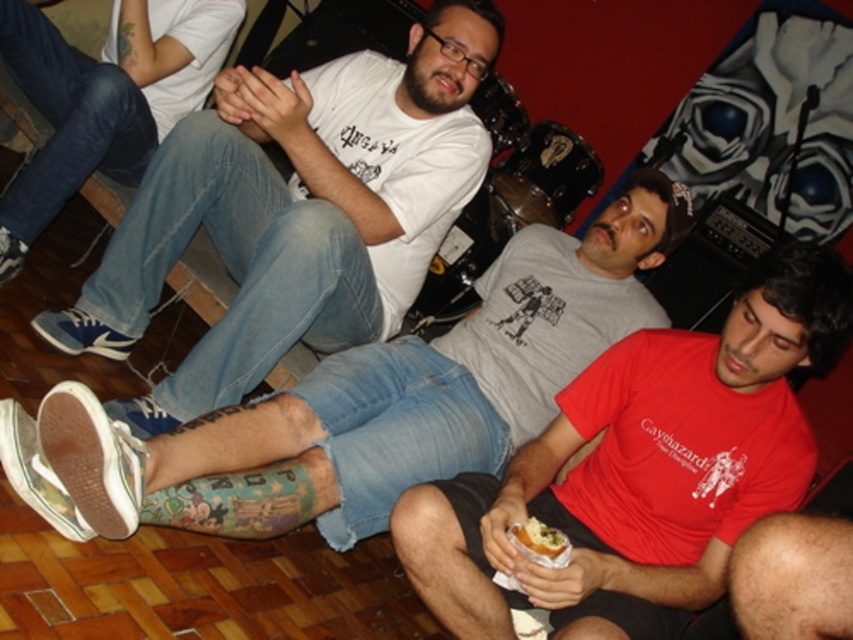
Looking at this image, is white matte t-shirt at center to the left of white bread at lower center from the viewer's perspective?

Correct, you'll find white matte t-shirt at center to the left of white bread at lower center.

In the scene shown: Who is taller, white matte t-shirt at center or white bread at lower center?

With more height is white matte t-shirt at center.

The image size is (853, 640). What do you see at coordinates (296, 211) in the screenshot? I see `white matte t-shirt at center` at bounding box center [296, 211].

Where is `white matte t-shirt at center`? white matte t-shirt at center is located at coordinates (296, 211).

Is red matte shirt at lower right below denim jeans at center?

Yes.

Does point (769, 307) lie in front of point (44, 216)?

Yes, it is in front of point (44, 216).

The image size is (853, 640). I want to click on red matte shirt at lower right, so click(642, 468).

Describe the element at coordinates (296, 211) in the screenshot. The width and height of the screenshot is (853, 640). I see `white matte t-shirt at center` at that location.

Where is `white matte t-shirt at center`? The image size is (853, 640). white matte t-shirt at center is located at coordinates (296, 211).